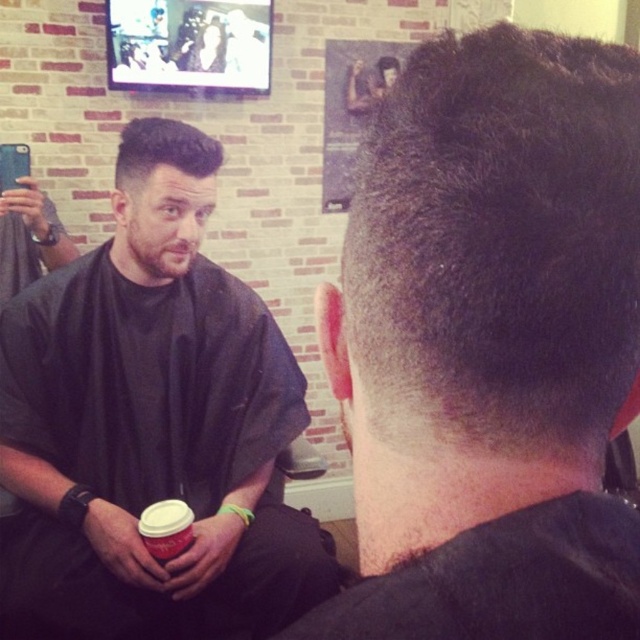
You are a customer in a barbershop and see two hairstyles displayed on a TV screen in the background. The hairstyles are labeled as dark brown hair at center and sleek dark hair at upper left. Which hairstyle is taller?

The dark brown hair at center is taller than the sleek dark hair at upper left.

You are a customer in a barbershop and you want to choose a hairstyle. You see two hairstyles in the image. The first is dark brown hair at center, and the second is sleek dark hair at upper left. Which hairstyle is narrower?

The dark brown hair at center is narrower than the sleek dark hair at upper left.

You are a customer in the barbershop and want to know which hair section is closer to the floor between the matte black hair at upper left and the sleek dark hair at upper left. Which one is closer?

The matte black hair at upper left is closer to the floor because it is located below the sleek dark hair at upper left.